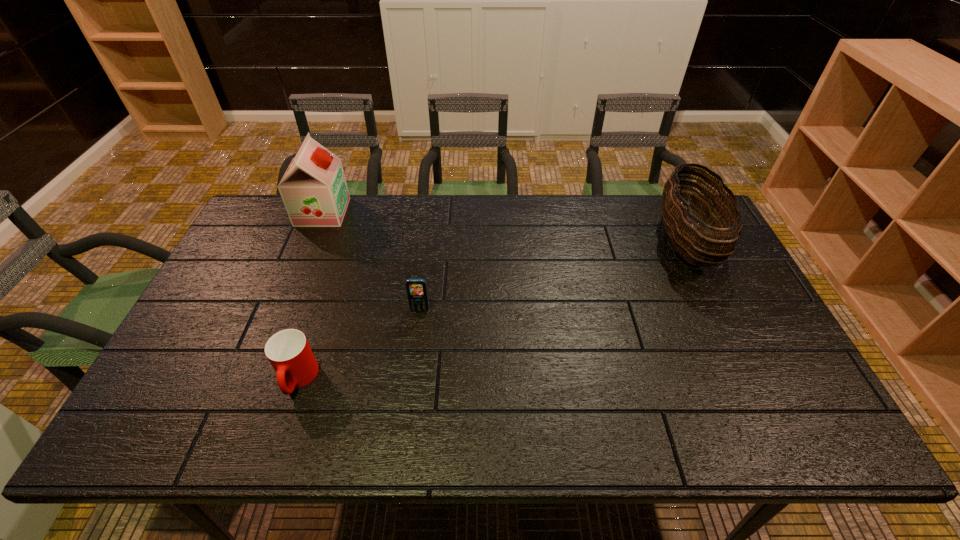
You are a GUI agent. You are given a task and a screenshot of the screen. Output one action in this format:
    pyautogui.click(x=<x>, y=<y>)
    Task: Click on the free space between the soya milk and the rightmost object
    
    Given the screenshot: What is the action you would take?
    pyautogui.click(x=504, y=227)

Locate an element on the screen. This screenshot has width=960, height=540. object that stands as the second closest to the soya milk is located at coordinates point(288,351).

The width and height of the screenshot is (960, 540). In order to click on object that is the second nearest to the soya milk in this screenshot , I will do [288, 351].

You are a GUI agent. You are given a task and a screenshot of the screen. Output one action in this format:
    pyautogui.click(x=<x>, y=<y>)
    Task: Click on the free location that satisfies the following two spatial constraints: 1. with the cap open on the soya milk; 2. on the left side of the second tallest object
    The image size is (960, 540).
    Given the screenshot: What is the action you would take?
    pyautogui.click(x=311, y=241)